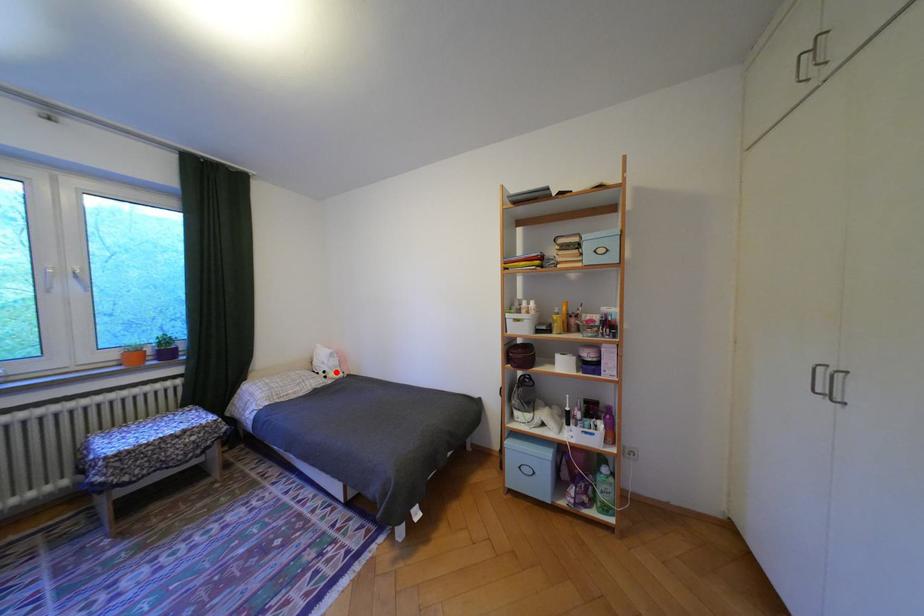
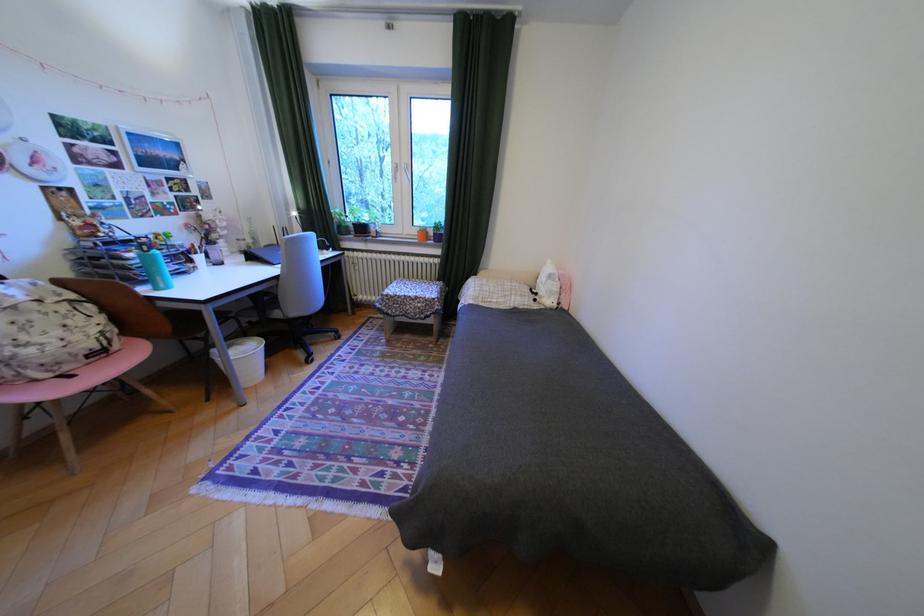
Question: I am providing you with two images of the same scene from different viewpoints. A red point is shown in image1. For the corresponding object point in image2, is it positioned nearer or farther from the camera?

Choices:
 (A) Nearer
 (B) Farther

Answer: (B)